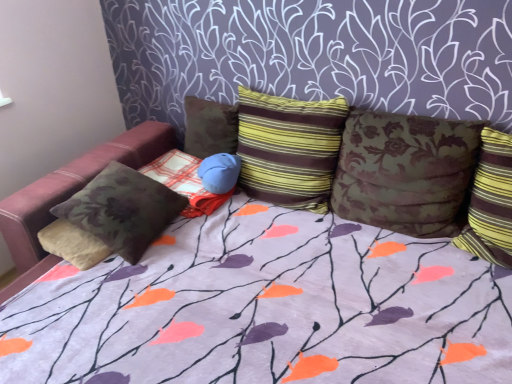
Question: Is striped fabric pillow at right, the first pillow viewed from the right, at the back of brown floral fabric bean bag chair at left?

Choices:
 (A) yes
 (B) no

Answer: (B)

Question: Can you confirm if brown floral fabric bean bag chair at left is bigger than striped fabric pillow at right, the first pillow viewed from the right?

Choices:
 (A) yes
 (B) no

Answer: (A)

Question: Can you confirm if brown floral fabric bean bag chair at left is taller than striped fabric pillow at right, which is the 6th pillow from left to right?

Choices:
 (A) yes
 (B) no

Answer: (B)

Question: From the image's perspective, would you say brown floral fabric bean bag chair at left is shown under striped fabric pillow at right, the first pillow viewed from the right?

Choices:
 (A) no
 (B) yes

Answer: (B)

Question: Does brown floral fabric bean bag chair at left have a smaller size compared to striped fabric pillow at right, the first pillow viewed from the right?

Choices:
 (A) yes
 (B) no

Answer: (B)

Question: Is point (478, 178) positioned closer to the camera than point (346, 190)?

Choices:
 (A) farther
 (B) closer

Answer: (B)

Question: Is striped fabric pillow at right, which is the 6th pillow from left to right, situated inside floral fabric pillow at center, marked as the second pillow in a right-to-left arrangement, or outside?

Choices:
 (A) outside
 (B) inside

Answer: (A)

Question: Considering the positions of striped fabric pillow at right, which is the 6th pillow from left to right, and floral fabric pillow at center, marked as the second pillow in a right-to-left arrangement, in the image, is striped fabric pillow at right, which is the 6th pillow from left to right, bigger or smaller than floral fabric pillow at center, marked as the second pillow in a right-to-left arrangement,?

Choices:
 (A) small
 (B) big

Answer: (A)

Question: From a real-world perspective, relative to floral fabric pillow at center, marked as the second pillow in a right-to-left arrangement, is striped fabric pillow at right, the first pillow viewed from the right, vertically above or below?

Choices:
 (A) below
 (B) above

Answer: (A)

Question: From the image's perspective, is velvet floral pillow at left, placed as the first pillow when sorted from left to right, above or below velvety brown pillow at center, positioned as the 5th pillow in right-to-left order?

Choices:
 (A) above
 (B) below

Answer: (B)

Question: Is point (128, 218) closer or farther from the camera than point (166, 170)?

Choices:
 (A) farther
 (B) closer

Answer: (B)

Question: Is velvet floral pillow at left, which is counted as the sixth pillow, starting from the right, in front of or behind velvety brown pillow at center, positioned as the 5th pillow in right-to-left order, in the image?

Choices:
 (A) behind
 (B) front

Answer: (B)

Question: In terms of width, does velvet floral pillow at left, which is counted as the sixth pillow, starting from the right, look wider or thinner when compared to velvety brown pillow at center, acting as the second pillow starting from the left?

Choices:
 (A) thin
 (B) wide

Answer: (B)

Question: Is point (476, 243) closer or farther from the camera than point (233, 119)?

Choices:
 (A) closer
 (B) farther

Answer: (A)

Question: In terms of height, does striped fabric pillow at right, the first pillow viewed from the right, look taller or shorter compared to brown floral pillow at center, the 4th pillow from the right?

Choices:
 (A) short
 (B) tall

Answer: (B)